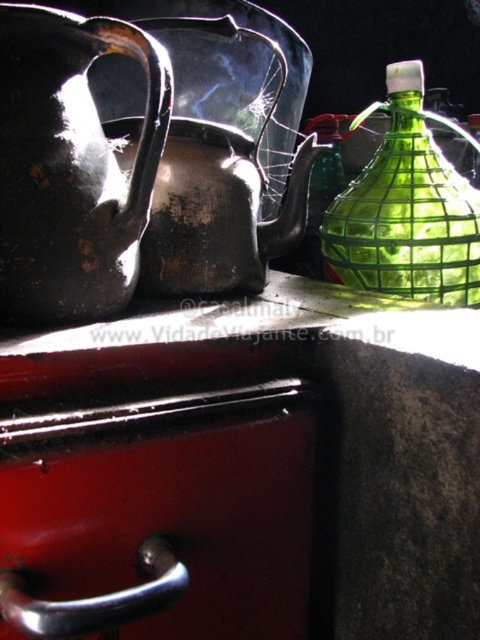
Question: Which point is farther to the camera?

Choices:
 (A) metallic red drawer at lower left
 (B) shiny metallic teapot at upper center

Answer: (B)

Question: Is shiny metallic teapot at upper center in front of green glass bottle at upper right?

Choices:
 (A) no
 (B) yes

Answer: (B)

Question: Based on their relative distances, which object is nearer to the shiny metallic teapot at upper center?

Choices:
 (A) green glass bottle at upper right
 (B) metallic red drawer at lower left

Answer: (A)

Question: Which object is positioned closest to the shiny metallic teapot at upper center?

Choices:
 (A) metallic red drawer at lower left
 (B) glossy ceramic jug at upper left

Answer: (B)

Question: Does glossy ceramic jug at upper left lie in front of shiny metallic teapot at upper center?

Choices:
 (A) no
 (B) yes

Answer: (B)

Question: Can you confirm if metallic red drawer at lower left is bigger than glossy ceramic jug at upper left?

Choices:
 (A) no
 (B) yes

Answer: (B)